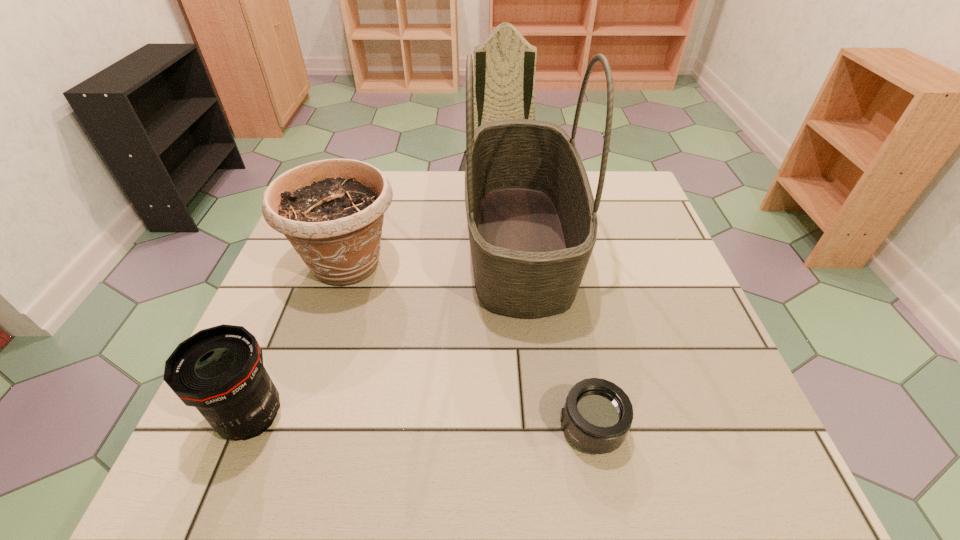
This screenshot has height=540, width=960. In order to click on the tallest object in this screenshot , I will do `click(532, 220)`.

Image resolution: width=960 pixels, height=540 pixels. I want to click on the second tallest object, so click(x=331, y=211).

I want to click on the second shortest object, so click(x=219, y=370).

What are the coordinates of `the left telephoto lens` in the screenshot? It's located at (219, 370).

This screenshot has width=960, height=540. In order to click on the right telephoto lens in this screenshot , I will do `click(597, 415)`.

This screenshot has width=960, height=540. In order to click on the shorter telephoto lens in this screenshot , I will do `click(597, 415)`.

Where is `blank space located 0.170m on the right of the tallest object`? The image size is (960, 540). blank space located 0.170m on the right of the tallest object is located at coordinates (641, 242).

Where is `vacant space located 0.110m on the back of the flowerpot`? This screenshot has height=540, width=960. vacant space located 0.110m on the back of the flowerpot is located at coordinates (366, 206).

The height and width of the screenshot is (540, 960). I want to click on vacant space located 0.110m on the right of the third tallest object, so (x=349, y=417).

Find the location of a particular element. The image size is (960, 540). free space located on the side of the right telephoto lens with brand markings and control switches is located at coordinates (426, 427).